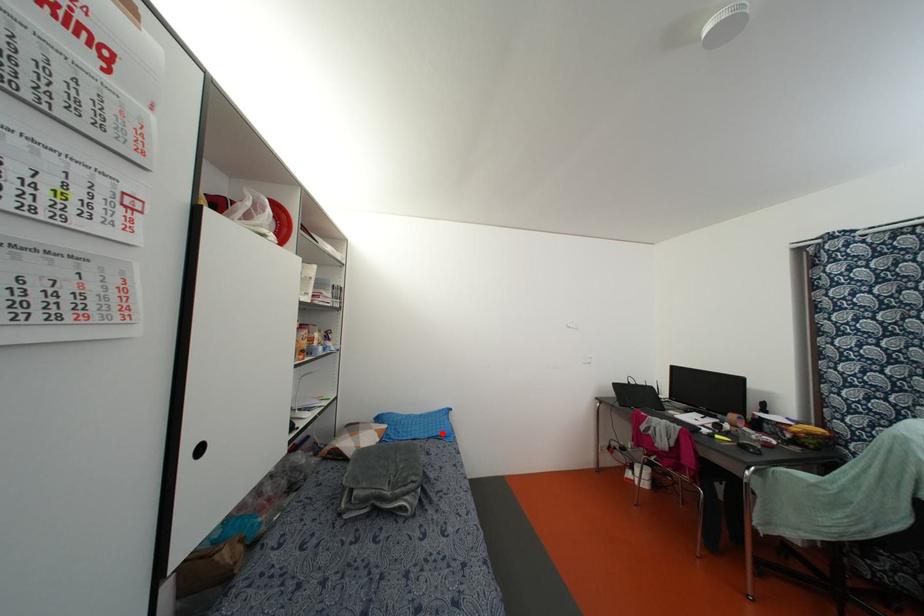
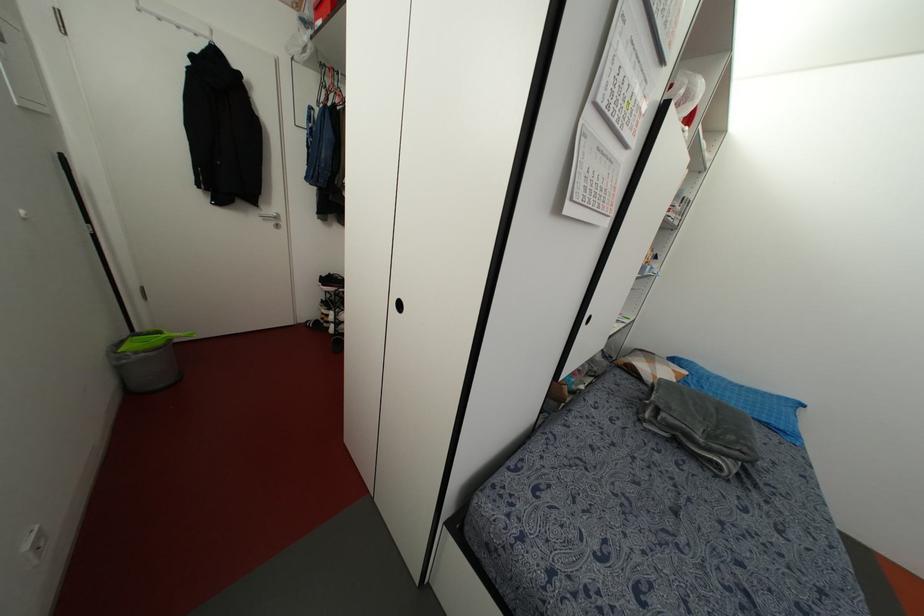
The point at the highlighted location is marked in the first image. Where is the corresponding point in the second image?

(782, 427)